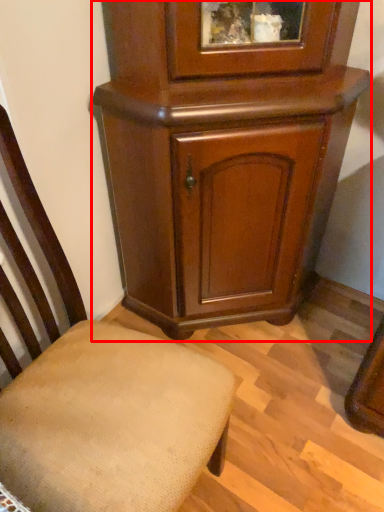
Question: From the image's perspective, what is the correct spatial positioning of cupboard (annotated by the red box) in reference to chair?

Choices:
 (A) above
 (B) below

Answer: (A)